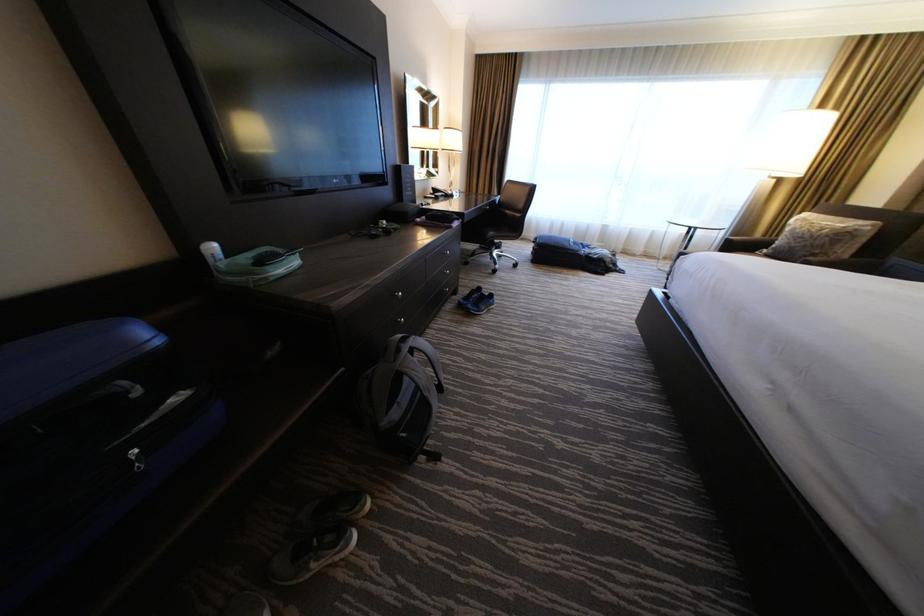
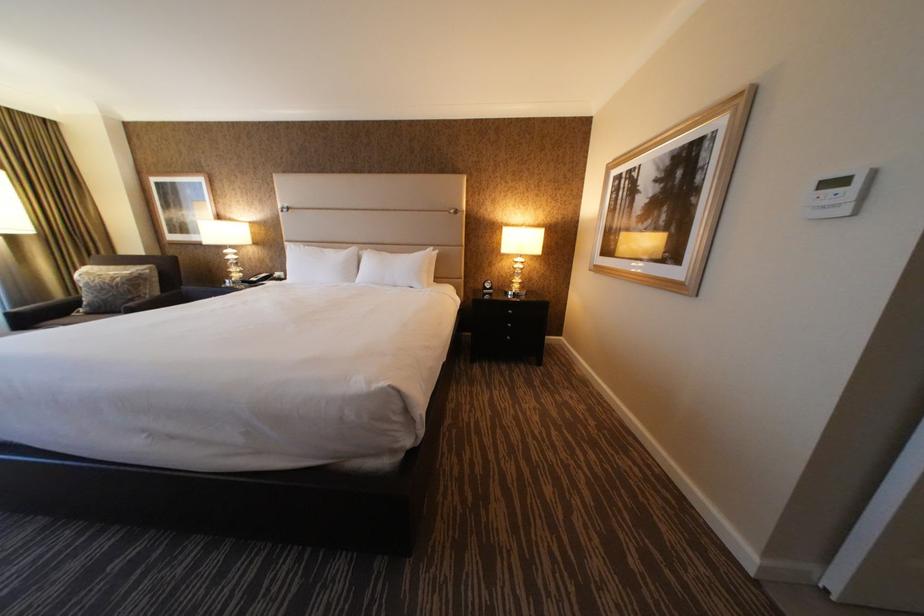
First-person continuous shooting, in which direction is the camera rotating?

The camera rotated toward right-down.